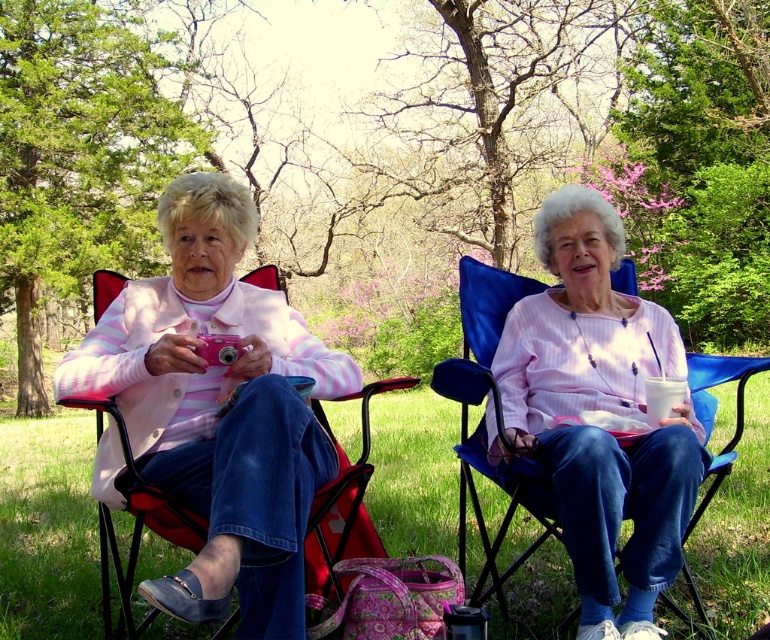
Is pink matte camera at left above pink striped shirt at center?

No, pink matte camera at left is not above pink striped shirt at center.

Who is taller, pink matte camera at left or pink striped shirt at center?

Standing taller between the two is pink striped shirt at center.

The height and width of the screenshot is (640, 770). What do you see at coordinates (216, 410) in the screenshot?
I see `pink matte camera at left` at bounding box center [216, 410].

I want to click on pink matte camera at left, so click(x=216, y=410).

Which is in front, point (208, 172) or point (243, 195)?

Point (243, 195) is more forward.

Is point (280, 628) farther from camera compared to point (209, 412)?

No, (280, 628) is closer to viewer.

Where is `pink striped sweater at center`? The image size is (770, 640). pink striped sweater at center is located at coordinates (216, 406).

Which of these two, pink striped sweater at center or pink striped shirt at center, stands shorter?

pink striped sweater at center

Does pink striped sweater at center appear over pink striped shirt at center?

Yes, pink striped sweater at center is above pink striped shirt at center.

Locate an element on the screen. This screenshot has width=770, height=640. pink striped sweater at center is located at coordinates (216, 406).